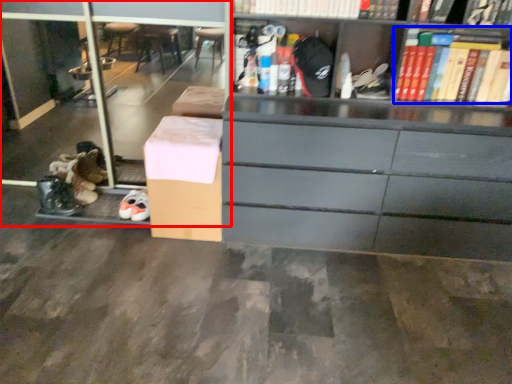
Question: Which of the following is the farthest to the observer, shelf (highlighted by a red box) or book (highlighted by a blue box)?

Choices:
 (A) shelf
 (B) book

Answer: (A)